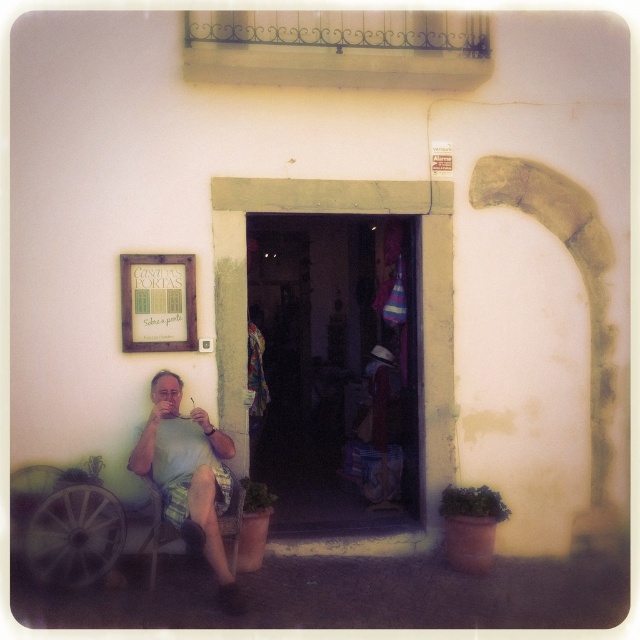
Which is behind, point (172, 445) or point (272, 502)?

The point (272, 502) is behind.

Can you confirm if white fabric shirt at left is positioned to the right of green leafy plant at lower center?

No, white fabric shirt at left is not to the right of green leafy plant at lower center.

The width and height of the screenshot is (640, 640). What do you see at coordinates (188, 476) in the screenshot?
I see `white fabric shirt at left` at bounding box center [188, 476].

The image size is (640, 640). What are the coordinates of `white fabric shirt at left` in the screenshot? It's located at (188, 476).

Can you confirm if green matte plant at lower right is shorter than green leafy plant at lower left?

Yes, green matte plant at lower right is shorter than green leafy plant at lower left.

In order to click on green matte plant at lower right in this screenshot , I will do point(472,502).

Can you confirm if green leafy plant at lower left is thinner than green leafy plant at lower center?

No, green leafy plant at lower left is not thinner than green leafy plant at lower center.

Is green leafy plant at lower left smaller than green leafy plant at lower center?

Correct, green leafy plant at lower left occupies less space than green leafy plant at lower center.

Between point (77, 477) and point (264, 509), which one is positioned behind?

Positioned behind is point (264, 509).

Find the location of a particular element. green leafy plant at lower left is located at coordinates (83, 474).